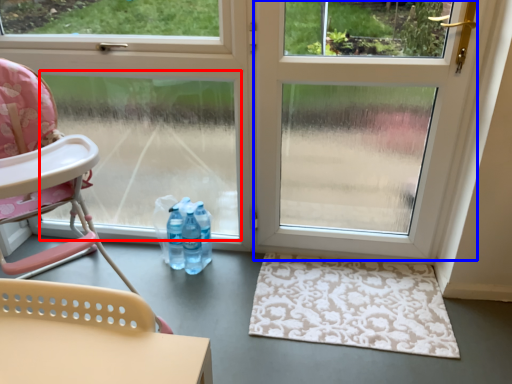
Question: Which object is closer to the camera taking this photo, window screen (highlighted by a red box) or screen door (highlighted by a blue box)?

Choices:
 (A) window screen
 (B) screen door

Answer: (B)